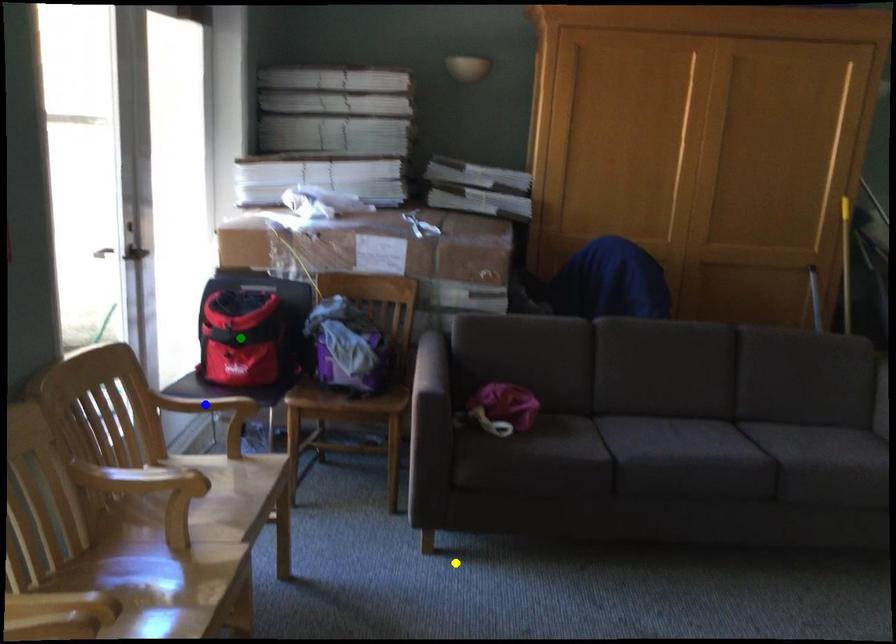
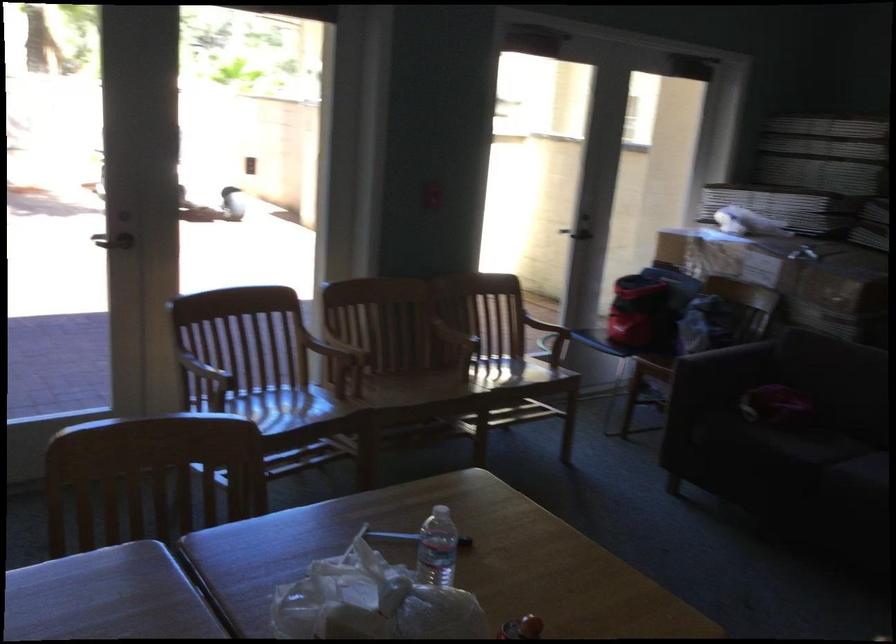
I am providing you with two images of the same scene from different viewpoints. Three points are marked in image1. Which point corresponds to a part or object that is occluded in image2?In image1, three points are marked. Which of them correspond to a part or object that is occluded in image2?Among the three points shown in image1, which one corresponds to a part or object that is no longer visible due to occlusion in image2?

Invisible in image2: blue point.